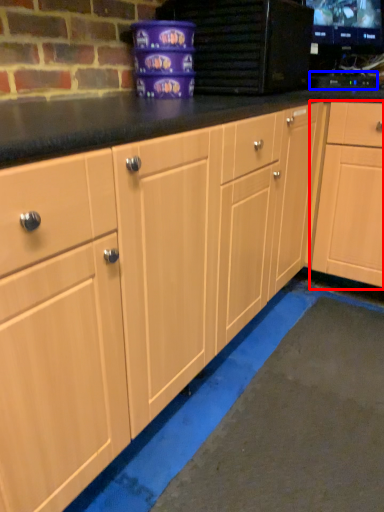
Question: Which object appears farthest to the camera in this image, cabinetry (highlighted by a red box) or appliance (highlighted by a blue box)?

Choices:
 (A) cabinetry
 (B) appliance

Answer: (B)